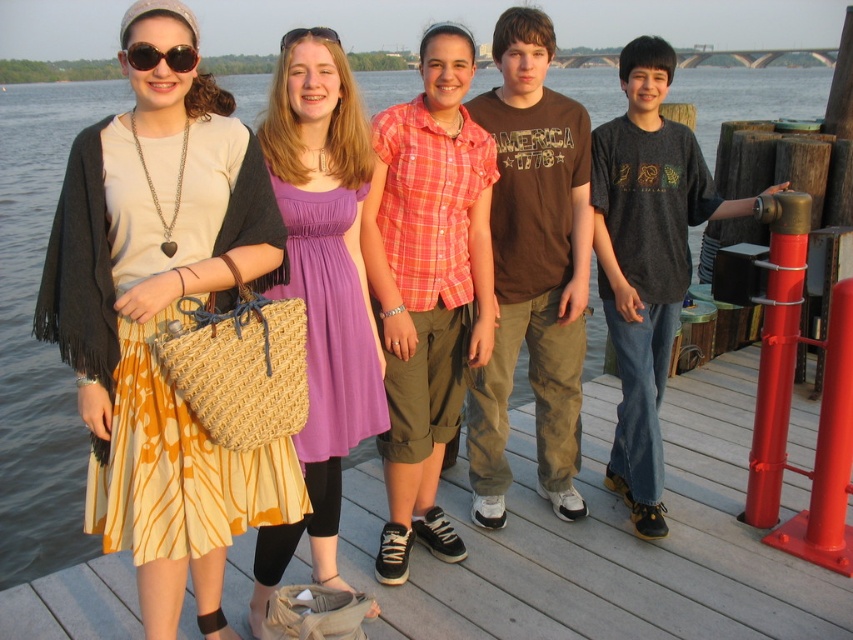
You are a GUI agent. You are given a task and a screenshot of the screen. Output one action in this format:
    pyautogui.click(x=<x>, y=<y>)
    Task: Click on the purple satin dress at center
    
    Given the screenshot: What is the action you would take?
    pyautogui.click(x=321, y=292)

The height and width of the screenshot is (640, 853). What are the coordinates of `purple satin dress at center` in the screenshot? It's located at (321, 292).

Locate an element on the screen. Image resolution: width=853 pixels, height=640 pixels. purple satin dress at center is located at coordinates (321, 292).

Between printed fabric skirt at left and sunglasses at upper left, which one appears on the left side from the viewer's perspective?

printed fabric skirt at left is more to the left.

Locate an element on the screen. Image resolution: width=853 pixels, height=640 pixels. printed fabric skirt at left is located at coordinates (163, 321).

Which is in front, point (202, 484) or point (181, 60)?

Point (181, 60) is more forward.

At what (x,y) coordinates should I click in order to perform the action: click on printed fabric skirt at left. Please return your answer as a coordinate pair (x, y). Image resolution: width=853 pixels, height=640 pixels. Looking at the image, I should click on (163, 321).

Does wooden deck at center come in front of brown cotton shirt at center?

Yes, it is in front of brown cotton shirt at center.

Who is more forward, (x=378, y=513) or (x=538, y=61)?

Point (x=538, y=61)

Where is `wooden deck at center`? This screenshot has width=853, height=640. wooden deck at center is located at coordinates (608, 541).

The width and height of the screenshot is (853, 640). Find the location of `wooden deck at center`. wooden deck at center is located at coordinates pos(608,541).